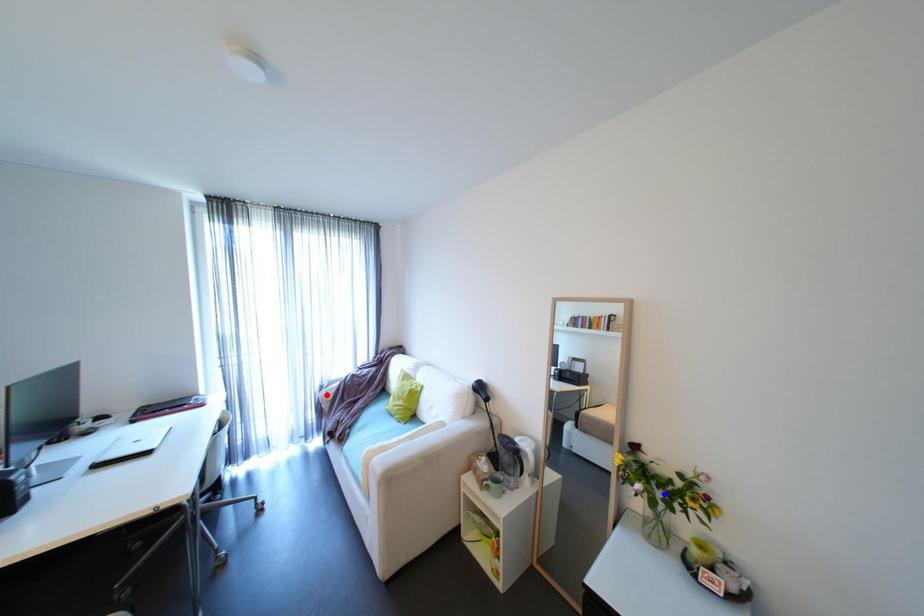
Question: Two points are marked on the image. Which point is closer to the camera?

Choices:
 (A) Blue point is closer.
 (B) Red point is closer.

Answer: (A)